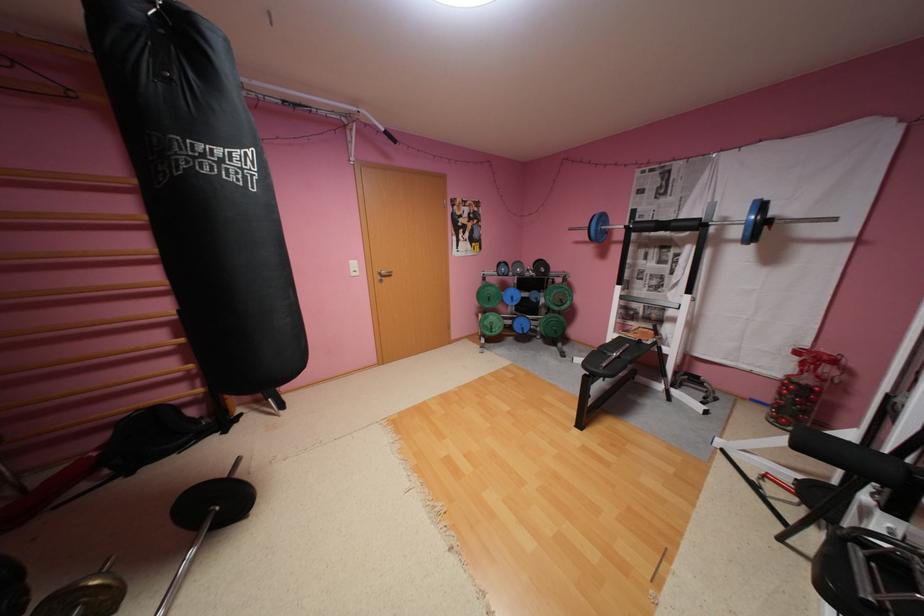
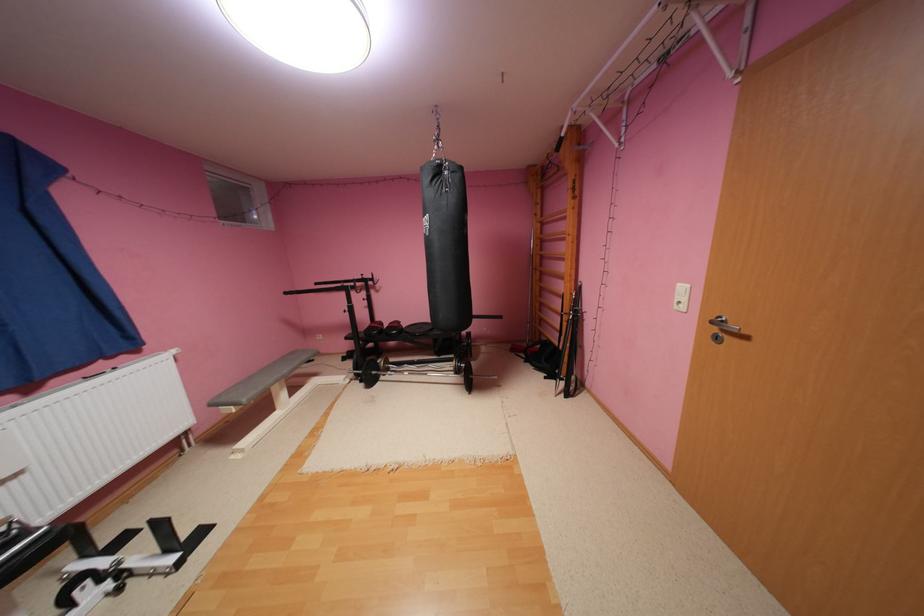
Locate, in the second image, the point that corresponds to point 362,274 in the first image.

(686, 306)